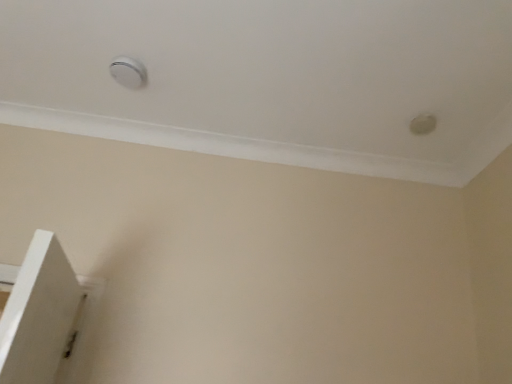
Question: From the image's perspective, relative to white plastic knob at upper right, which is the second knob from left to right, is white plastic knob at upper center, the 1th knob from the left, above or below?

Choices:
 (A) below
 (B) above

Answer: (B)

Question: Is white plastic knob at upper center, which is counted as the second knob, starting from the bottom, to the left or to the right of white plastic knob at upper right, which is the second knob from left to right, in the image?

Choices:
 (A) right
 (B) left

Answer: (B)

Question: Considering the positions of white plastic knob at upper center, the 1th knob viewed from the top, and white plastic knob at upper right, which is the second knob from left to right, in the image, is white plastic knob at upper center, the 1th knob viewed from the top, bigger or smaller than white plastic knob at upper right, which is the second knob from left to right,?

Choices:
 (A) small
 (B) big

Answer: (B)

Question: In terms of height, does white plastic knob at upper right, which is the 1th knob from right to left, look taller or shorter compared to white plastic knob at upper center, the 2th knob positioned from the right?

Choices:
 (A) short
 (B) tall

Answer: (A)

Question: From the image's perspective, is white plastic knob at upper right, arranged as the first knob when ordered from the bottom, located above or below white plastic knob at upper center, the 2th knob positioned from the right?

Choices:
 (A) above
 (B) below

Answer: (B)

Question: Visually, is white plastic knob at upper right, arranged as the first knob when ordered from the bottom, positioned to the left or to the right of white plastic knob at upper center, the 1th knob from the left?

Choices:
 (A) right
 (B) left

Answer: (A)

Question: Do you think white plastic knob at upper right, which is the second knob from left to right, is within white plastic knob at upper center, the 1th knob from the left, or outside of it?

Choices:
 (A) inside
 (B) outside

Answer: (B)